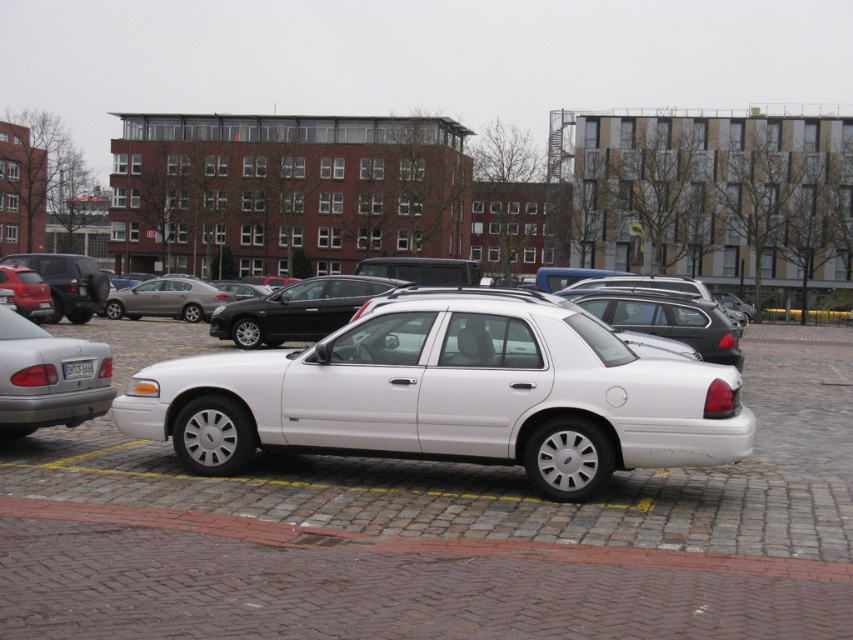
Is white glossy car at center positioned at the back of white plastic license plate at center?

No.

Which is above, white glossy car at center or white plastic license plate at center?

white plastic license plate at center is higher up.

Does point (131, 353) come farther from viewer compared to point (84, 360)?

Yes, point (131, 353) is farther from viewer.

Locate an element on the screen. The height and width of the screenshot is (640, 853). white glossy car at center is located at coordinates (439, 536).

Does point (82, 340) come in front of point (82, 372)?

No, (82, 340) is further to viewer.

Does silver metallic sedan at left appear on the right side of white plastic license plate at center?

No, silver metallic sedan at left is not to the right of white plastic license plate at center.

Is point (47, 340) behind point (88, 376)?

No, (47, 340) is closer to viewer.

Identify the location of silver metallic sedan at left. (47, 378).

Which is below, white glossy car at center or silver metallic sedan at left?

white glossy car at center is lower down.

What do you see at coordinates (439, 536) in the screenshot? The height and width of the screenshot is (640, 853). I see `white glossy car at center` at bounding box center [439, 536].

You are a GUI agent. You are given a task and a screenshot of the screen. Output one action in this format:
    pyautogui.click(x=<x>, y=<y>)
    Task: Click on the white glossy car at center
    
    Given the screenshot: What is the action you would take?
    pyautogui.click(x=439, y=536)